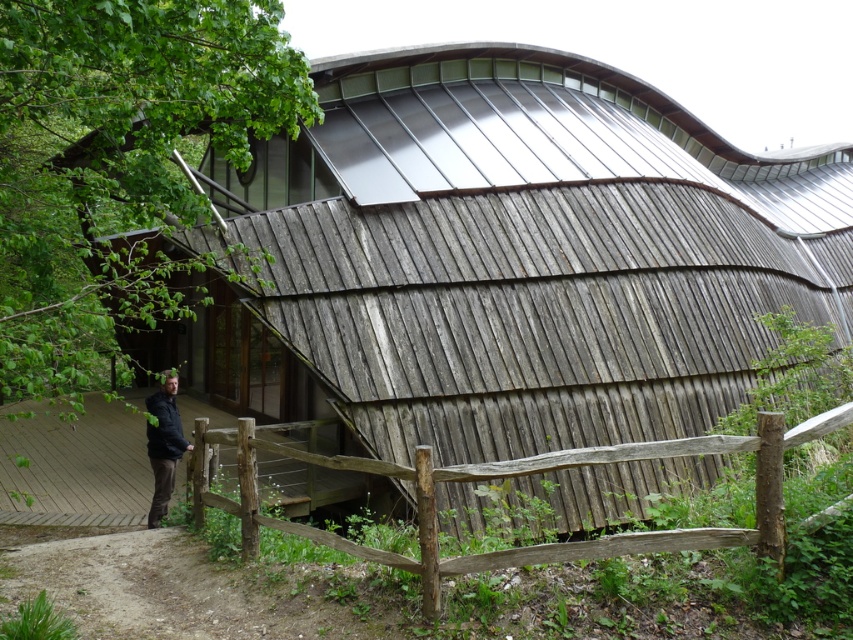
Can you confirm if weathered wood fence at lower center is bigger than dark gray hoodie at center?

Indeed, weathered wood fence at lower center has a larger size compared to dark gray hoodie at center.

Between weathered wood fence at lower center and dark gray hoodie at center, which one has more height?

dark gray hoodie at center is taller.

Who is more forward, (827, 419) or (173, 401)?

Result: Point (827, 419)

Identify the location of weathered wood fence at lower center. Image resolution: width=853 pixels, height=640 pixels. (518, 476).